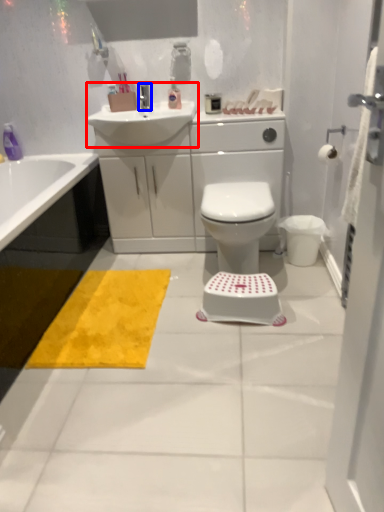
Question: Among these objects, which one is nearest to the camera, sink (highlighted by a red box) or tap (highlighted by a blue box)?

Choices:
 (A) sink
 (B) tap

Answer: (A)